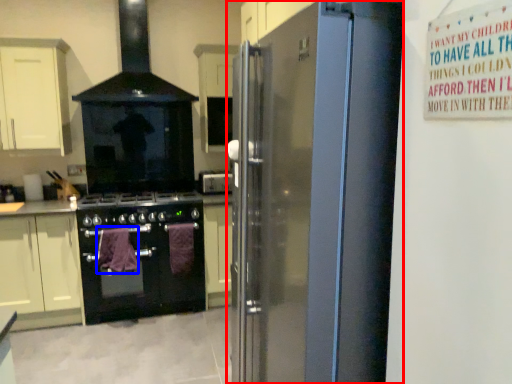
Question: Which object is closer to the camera taking this photo, refrigerator (highlighted by a red box) or blanket (highlighted by a blue box)?

Choices:
 (A) refrigerator
 (B) blanket

Answer: (A)